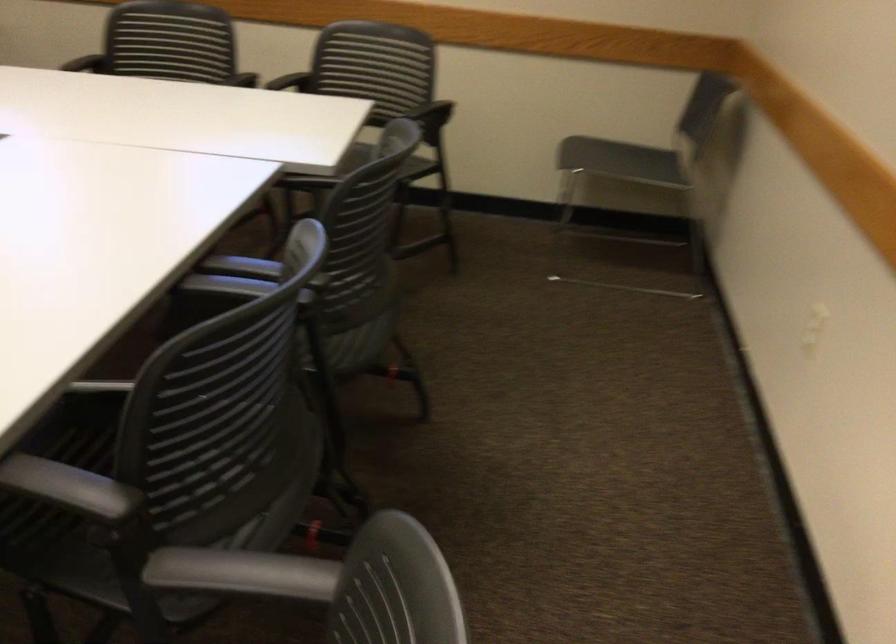
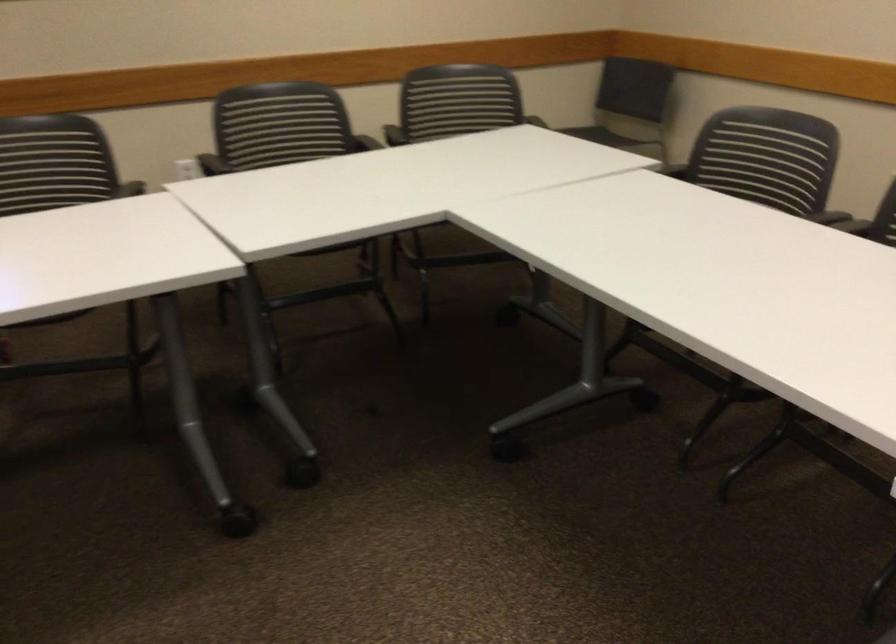
Find the pixel in the second image that matches (601,120) in the first image.

(529, 113)